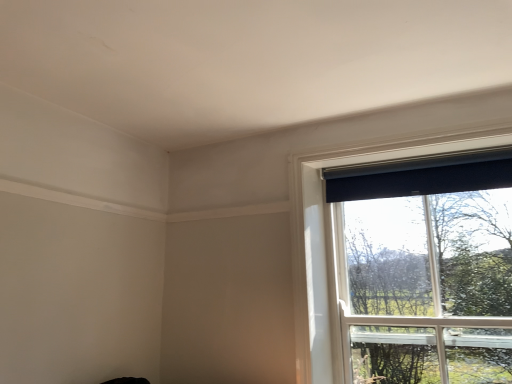
Question: Considering their positions, is black matte window at upper right located in front of or behind black matte curtain at upper right?

Choices:
 (A) front
 (B) behind

Answer: (A)

Question: Looking at their shapes, would you say black matte window at upper right is wider or thinner than black matte curtain at upper right?

Choices:
 (A) wide
 (B) thin

Answer: (A)

Question: From a real-world perspective, is black matte window at upper right above or below black matte curtain at upper right?

Choices:
 (A) above
 (B) below

Answer: (B)

Question: Considering the positions of black matte curtain at upper right and black matte window at upper right in the image, is black matte curtain at upper right bigger or smaller than black matte window at upper right?

Choices:
 (A) small
 (B) big

Answer: (A)

Question: Is black matte curtain at upper right inside the boundaries of black matte window at upper right, or outside?

Choices:
 (A) outside
 (B) inside

Answer: (B)

Question: Visually, is black matte curtain at upper right positioned to the left or to the right of black matte window at upper right?

Choices:
 (A) left
 (B) right

Answer: (A)

Question: Considering the positions of point (440, 165) and point (321, 374), is point (440, 165) closer or farther from the camera than point (321, 374)?

Choices:
 (A) farther
 (B) closer

Answer: (B)